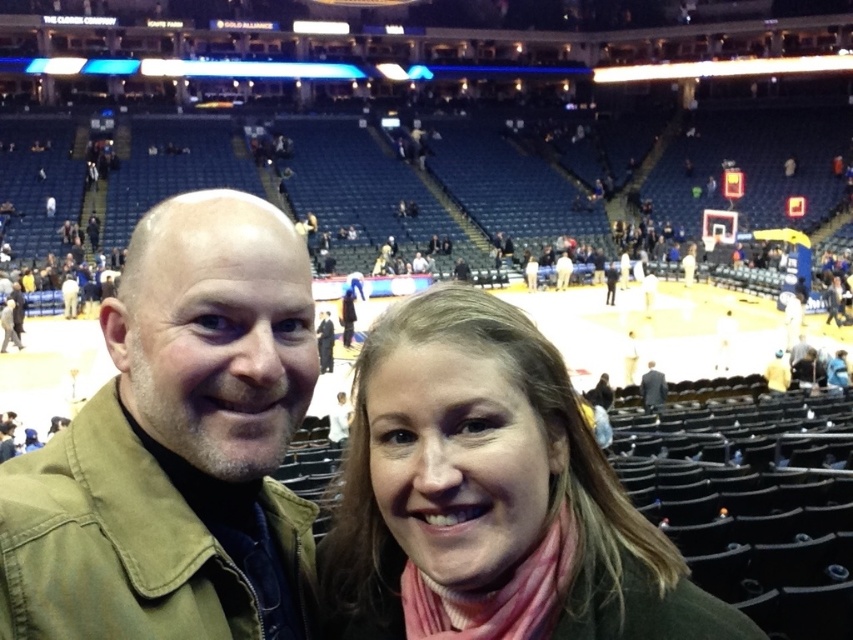
Does pink wool scarf at center have a greater width compared to dark gray suit at center?

Correct, the width of pink wool scarf at center exceeds that of dark gray suit at center.

Who is positioned more to the right, pink wool scarf at center or dark gray suit at center?

dark gray suit at center is more to the right.

Measure the distance between point (595, 630) and camera.

The distance of point (595, 630) from camera is 22.61 feet.

Image resolution: width=853 pixels, height=640 pixels. What are the coordinates of `pink wool scarf at center` in the screenshot? It's located at (489, 484).

Who is lower down, khaki cotton jacket at left or pink wool scarf at center?

pink wool scarf at center is lower down.

Does khaki cotton jacket at left lie in front of pink wool scarf at center?

That is False.

Does point (221, 586) come in front of point (389, 320)?

Yes, it is in front of point (389, 320).

Find the location of a particular element. khaki cotton jacket at left is located at coordinates (177, 445).

Who is positioned more to the left, khaki cotton jacket at left or dark gray suit at center?

khaki cotton jacket at left

Can you confirm if khaki cotton jacket at left is positioned to the right of dark gray suit at center?

Incorrect, khaki cotton jacket at left is not on the right side of dark gray suit at center.

Identify the location of khaki cotton jacket at left. The width and height of the screenshot is (853, 640). pos(177,445).